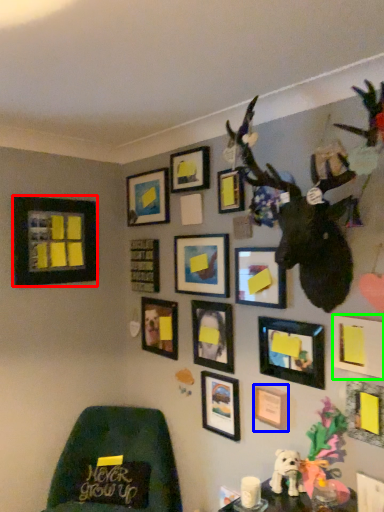
Question: Which object is the farthest from picture frame (highlighted by a red box)? Choose among these: picture frame (highlighted by a blue box) or picture frame (highlighted by a green box).

Choices:
 (A) picture frame
 (B) picture frame

Answer: (B)